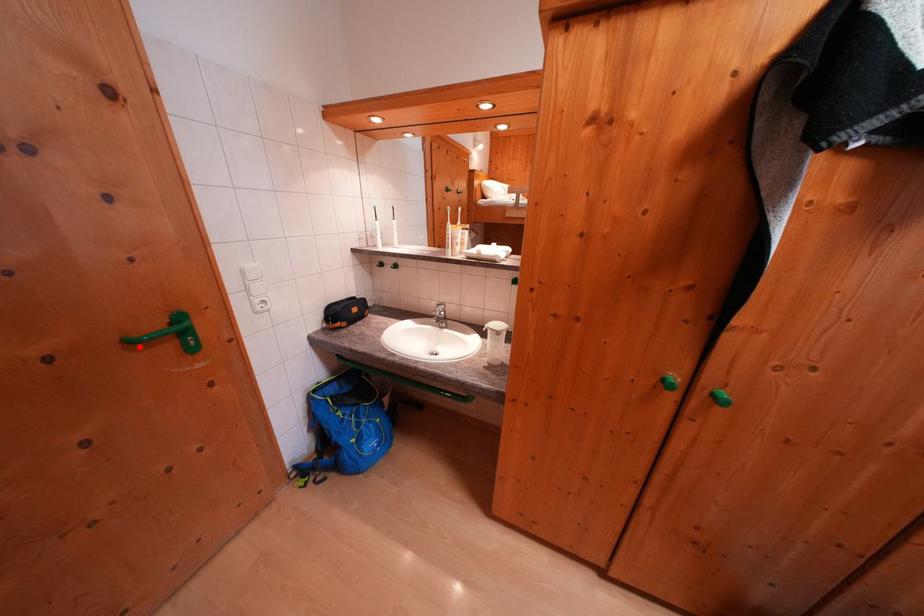
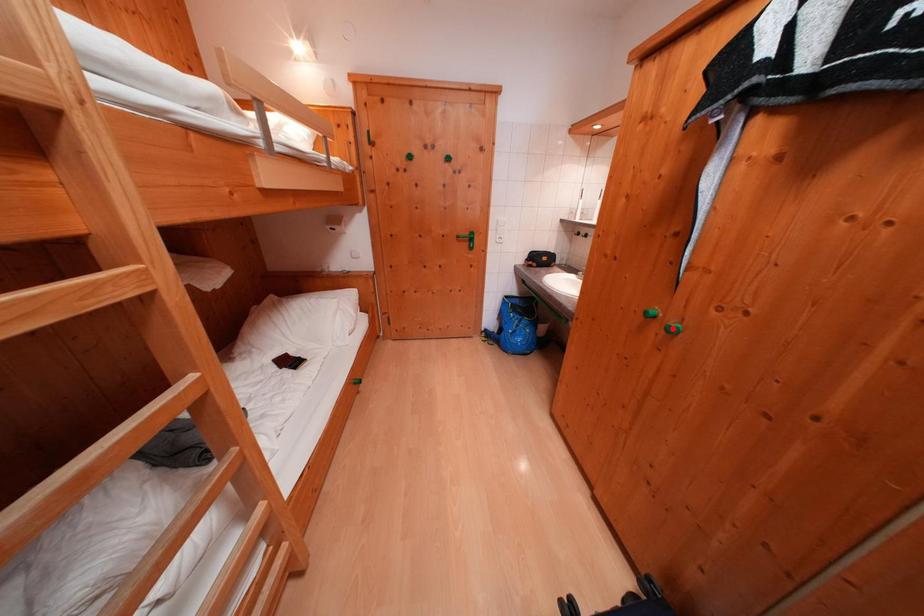
I am providing you with two images of the same scene from different viewpoints. A red point is marked on the first image and another point is marked on the second image. Is the red point in image1 aligned with the point shown in image2?

No